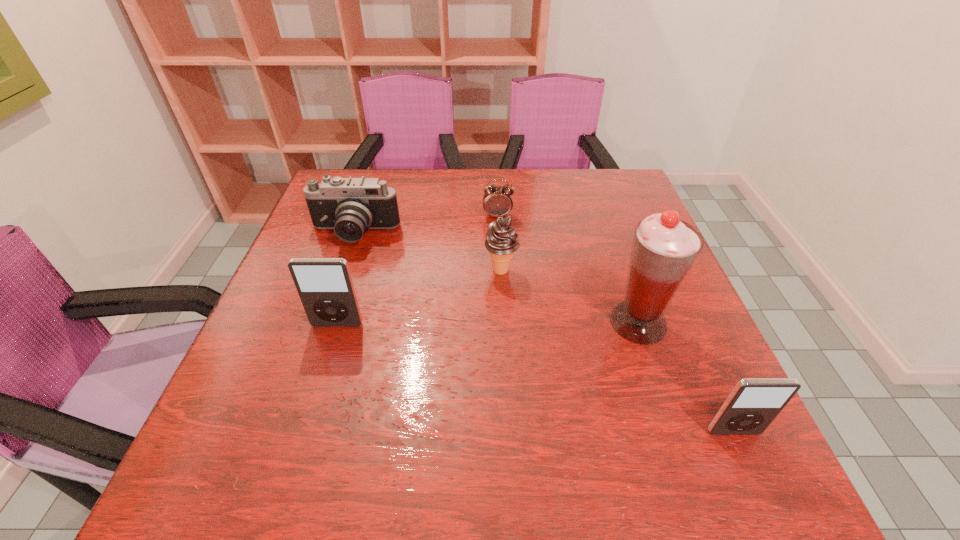
Locate an element on the screen. This screenshot has height=540, width=960. object located in the near right corner section of the desktop is located at coordinates (752, 405).

Find the location of a particular element. Image resolution: width=960 pixels, height=540 pixels. free space at the far edge of the desktop is located at coordinates (532, 193).

Where is `free space at the near edge`? Image resolution: width=960 pixels, height=540 pixels. free space at the near edge is located at coordinates (639, 406).

Locate an element on the screen. This screenshot has height=540, width=960. vacant space at the left edge is located at coordinates (323, 256).

In the image, there is a desktop. Where is `vacant area at the right edge`? vacant area at the right edge is located at coordinates (671, 313).

Identify the location of free region at the near left corner of the desktop. (229, 415).

Identify the location of free region at the far right corner of the desktop. (624, 170).

Where is `vacant space that's between the right iPod and the tallest object`? vacant space that's between the right iPod and the tallest object is located at coordinates (685, 377).

Find the location of a particular element. vacant region between the shortest object and the fifth nearest object is located at coordinates (426, 225).

Find the location of a particular element. The width and height of the screenshot is (960, 540). empty location between the right iPod and the fifth nearest object is located at coordinates (544, 333).